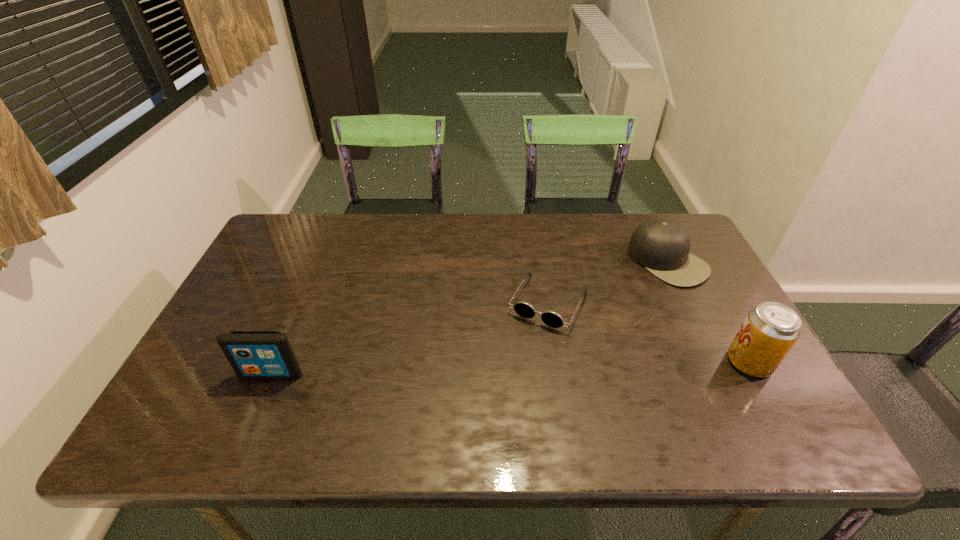
Identify the location of object that is at the near left corner. The width and height of the screenshot is (960, 540). (252, 354).

Find the location of a particular element. The width and height of the screenshot is (960, 540). object present at the far right corner is located at coordinates (662, 246).

Where is `object that is at the near right corner`? This screenshot has height=540, width=960. object that is at the near right corner is located at coordinates (770, 330).

Locate an element on the screen. This screenshot has width=960, height=540. vacant space at the far edge of the desktop is located at coordinates (x=367, y=229).

Locate an element on the screen. blank space at the near edge is located at coordinates pyautogui.click(x=331, y=391).

You are a GUI agent. You are given a task and a screenshot of the screen. Output one action in this format:
    pyautogui.click(x=<x>, y=<y>)
    Task: Click on the vacant space at the left edge of the desktop
    This screenshot has height=540, width=960.
    Given the screenshot: What is the action you would take?
    pyautogui.click(x=265, y=281)

The height and width of the screenshot is (540, 960). In order to click on free space at the right edge of the desktop in this screenshot , I will do `click(682, 288)`.

In the image, there is a desktop. Where is `blank space at the far left corner`? The width and height of the screenshot is (960, 540). blank space at the far left corner is located at coordinates (320, 233).

At what (x,y) coordinates should I click in order to perform the action: click on vacant space at the far right corner of the desktop. Please return your answer as a coordinate pair (x, y). This screenshot has height=540, width=960. Looking at the image, I should click on (657, 213).

Locate an element on the screen. This screenshot has height=540, width=960. empty location between the sunglasses and the cap is located at coordinates (609, 282).